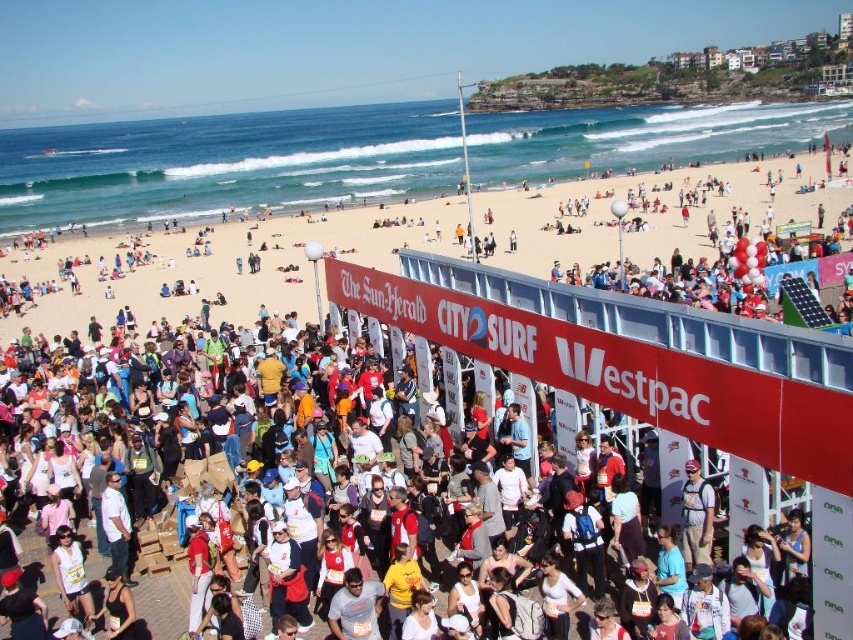
Question: Which object appears farthest from the camera in this image?

Choices:
 (A) white cotton crowd at center
 (B) white sand beach at upper center

Answer: (B)

Question: Does white cotton crowd at center have a lesser width compared to white sand beach at upper center?

Choices:
 (A) yes
 (B) no

Answer: (A)

Question: Is white cotton crowd at center thinner than white sand beach at upper center?

Choices:
 (A) no
 (B) yes

Answer: (B)

Question: Among these points, which one is nearest to the camera?

Choices:
 (A) (425, 499)
 (B) (523, 220)

Answer: (A)

Question: Which of the following is the farthest from the observer?

Choices:
 (A) (67, 492)
 (B) (834, 161)

Answer: (B)

Question: Does white cotton crowd at center lie in front of white sand beach at upper center?

Choices:
 (A) no
 (B) yes

Answer: (B)